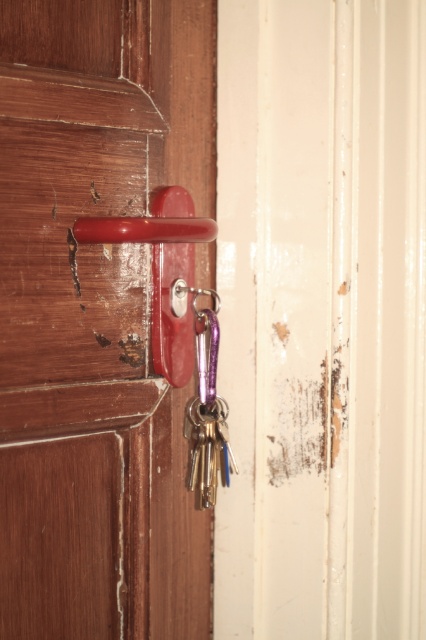
You are trying to unlock the door and need to reach both the rubberized red door handle at center and the purple metallic key at center. Which object is closer to your hand?

The rubberized red door handle at center is closer to the viewer than the purple metallic key at center, so you can reach it first.

You are trying to unlock the door shown in the image. You have a purple metallic key at center. Before reaching for it, you notice the rubberized red door handle at center. Where is the purple metallic key located in relation to the door handle?

The purple metallic key at center is located below the rubberized red door handle at center because the door handle is positioned over it.